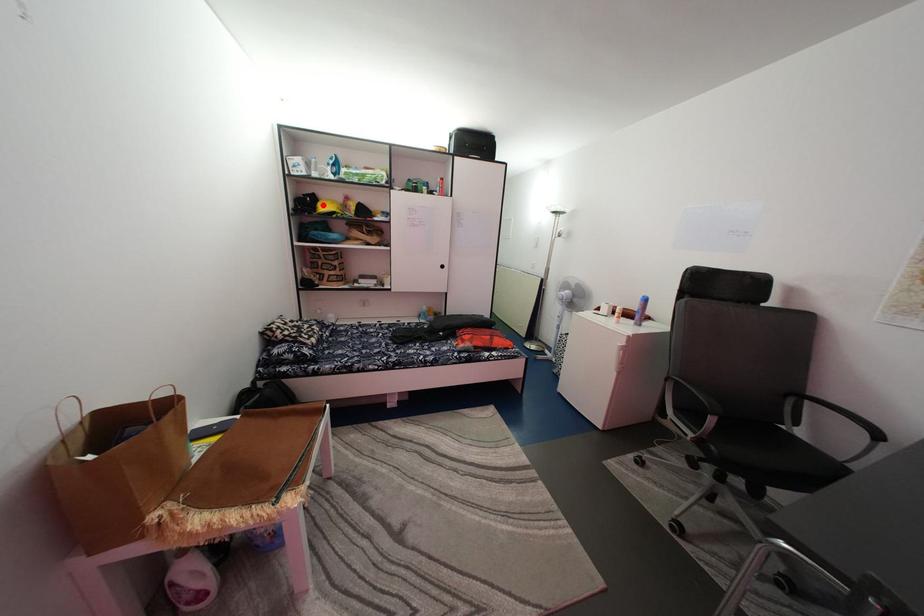
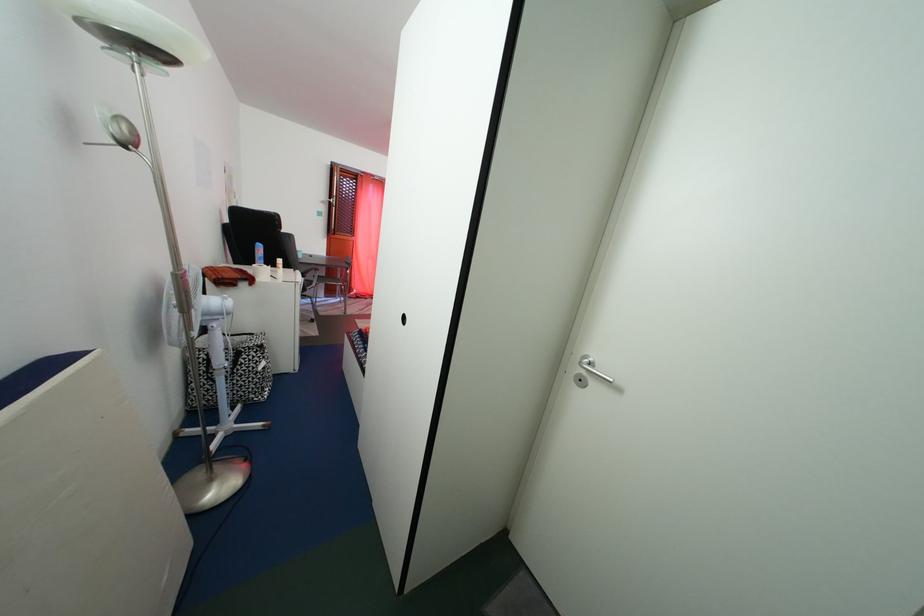
Question: I am providing you with two images of the same scene from different viewpoints. A red point is marked on the first image. At the location where the point appears in image 1, is it still visible in image 2?

Choices:
 (A) Yes
 (B) No

Answer: (B)